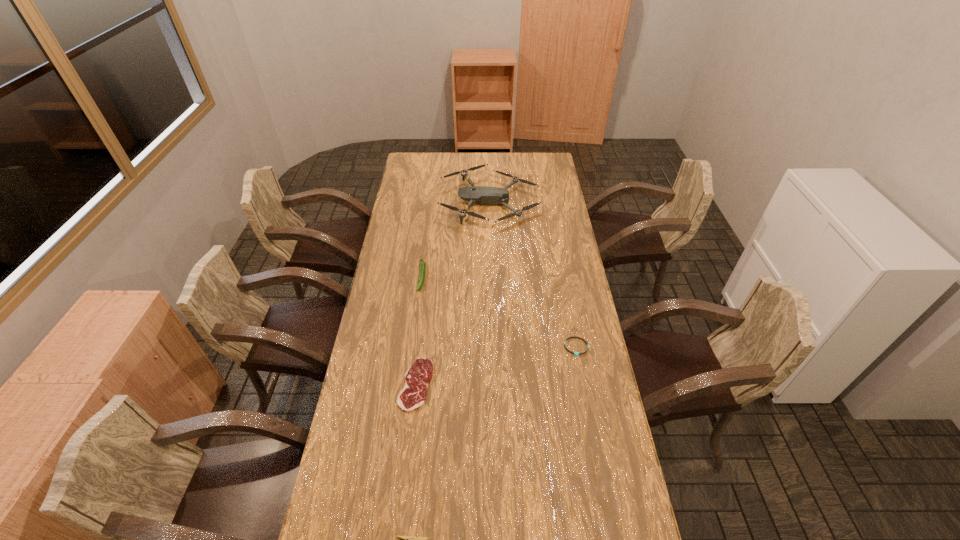
The image size is (960, 540). In the image, there is a desktop. In order to click on free space at the right edge in this screenshot , I will do `click(529, 179)`.

Find the location of `free region at the far left corner`. free region at the far left corner is located at coordinates (418, 158).

I want to click on free space at the far right corner of the desktop, so click(x=548, y=160).

At what (x,y) coordinates should I click in order to perform the action: click on vacant area that lies between the second nearest object and the drone. Please return your answer as a coordinate pair (x, y). Looking at the image, I should click on (453, 293).

Where is `empty space that is in between the wristband and the steak`? empty space that is in between the wristband and the steak is located at coordinates (496, 366).

Locate an element on the screen. This screenshot has height=540, width=960. free space between the wristband and the fourth shortest object is located at coordinates (499, 312).

This screenshot has height=540, width=960. Identify the location of vacant space that is in between the second farthest object and the third farthest object. (499, 312).

Identify the location of vacant area between the fourth farthest object and the wristband. This screenshot has height=540, width=960. (496, 366).

Find the location of a particular element. unoccupied position between the tallest object and the zucchini is located at coordinates (456, 239).

Where is `free spot between the fourth shortest object and the third nearest object`? Image resolution: width=960 pixels, height=540 pixels. free spot between the fourth shortest object and the third nearest object is located at coordinates (499, 312).